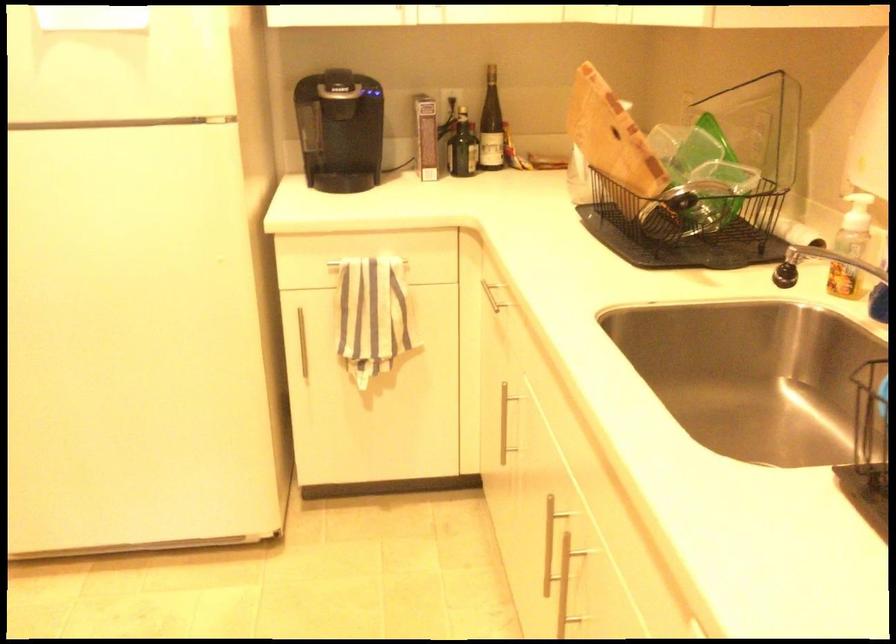
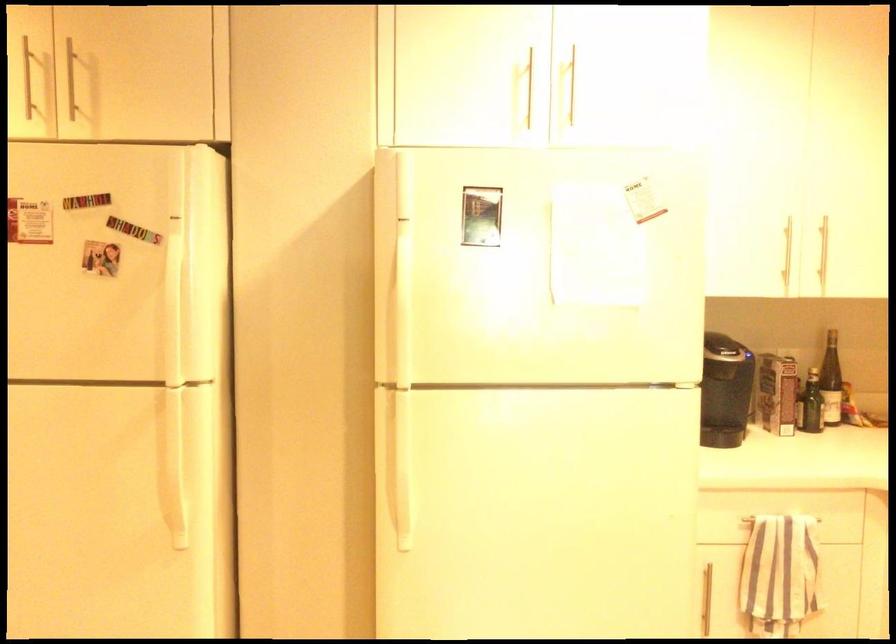
Where in the second image is the point corresponding to (369,260) from the first image?

(781, 518)